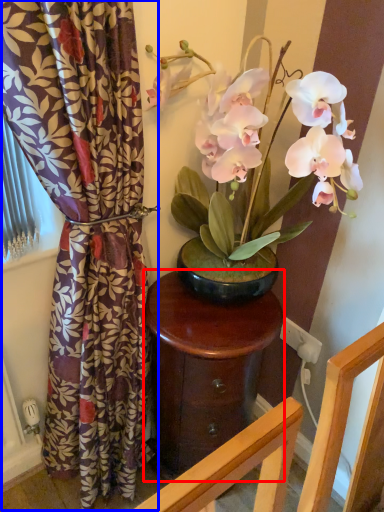
Question: Which of the following is the farthest to the observer, table (highlighted by a red box) or curtain (highlighted by a blue box)?

Choices:
 (A) table
 (B) curtain

Answer: (A)